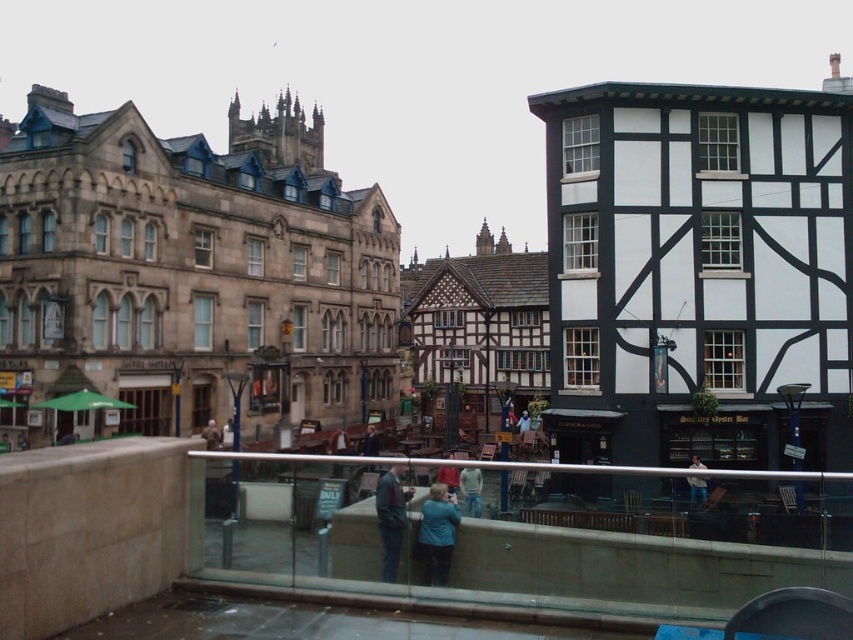
You are a fashion designer observing the urban scene. You notice the denim pants at lower center and the blue denim jacket at center. Which clothing item takes up more visual space in the image?

The blue denim jacket at center occupies more visual space than the denim pants at lower center, as it is stated that the denim pants at lower center occupies less space than the blue denim jacket at center.

You are standing on a balcony overlooking the street and want to take a photo. There are two points of interest marked as point (689, 465) and point (521, 417). Which point will appear closer to you in your camera view?

Point (689, 465) is closer to the viewer than point (521, 417), so it will appear closer in the camera view.